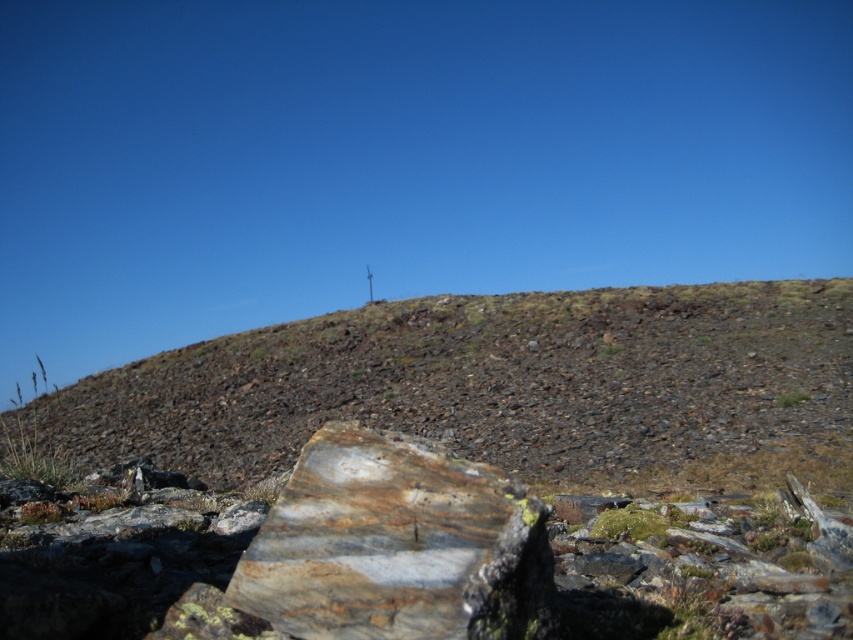
Question: Which point is farther to the camera?

Choices:
 (A) (521, 625)
 (B) (488, 305)

Answer: (B)

Question: Can you confirm if rusty stone hillside at upper center is positioned above rusty stone at center?

Choices:
 (A) no
 (B) yes

Answer: (A)

Question: Can you confirm if rusty stone hillside at upper center is thinner than rusty stone at center?

Choices:
 (A) yes
 (B) no

Answer: (B)

Question: Is rusty stone hillside at upper center closer to camera compared to rusty stone at center?

Choices:
 (A) yes
 (B) no

Answer: (B)